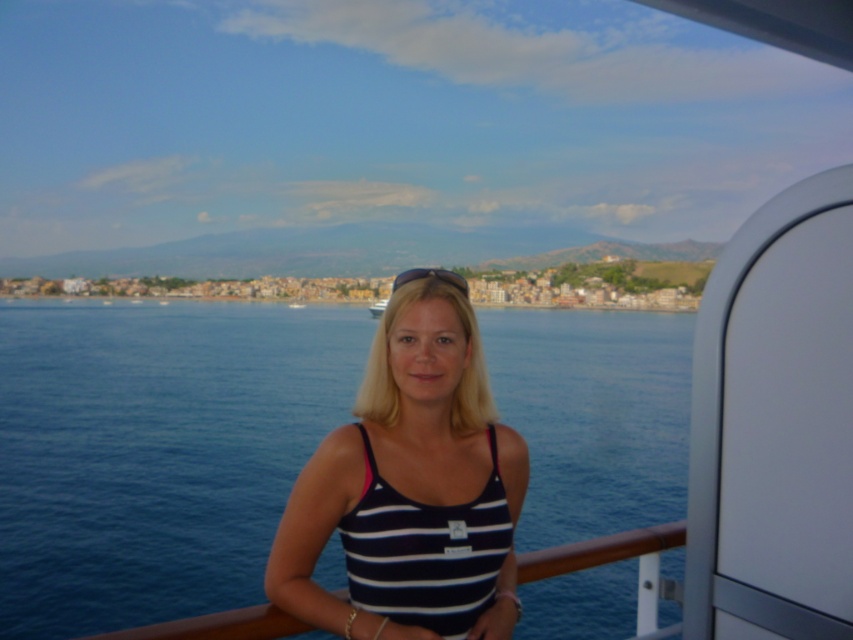
Question: Which object appears closest to the camera in this image?

Choices:
 (A) blue liquid water at center
 (B) white striped tank top at center

Answer: (B)

Question: Can you confirm if blue liquid water at center is bigger than white striped tank top at center?

Choices:
 (A) yes
 (B) no

Answer: (A)

Question: Is blue liquid water at center positioned before white striped tank top at center?

Choices:
 (A) no
 (B) yes

Answer: (A)

Question: From the image, what is the correct spatial relationship of blue liquid water at center in relation to white striped tank top at center?

Choices:
 (A) below
 (B) above

Answer: (B)